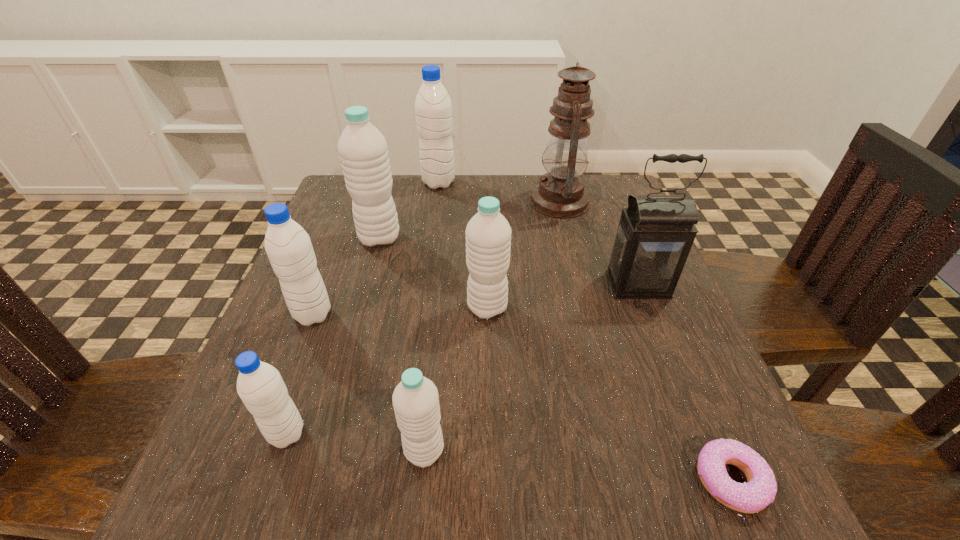
Find the location of a particular element. oil lamp is located at coordinates (560, 193).

Find the location of a particular element. The height and width of the screenshot is (540, 960). the farthest water bottle is located at coordinates (433, 107).

At what (x,y) coordinates should I click in order to perform the action: click on the rightmost gray water bottle. Please return your answer as a coordinate pair (x, y). The width and height of the screenshot is (960, 540). Looking at the image, I should click on (433, 107).

Where is `the leftmost white water bottle`? the leftmost white water bottle is located at coordinates (363, 150).

Where is `the biggest white water bottle`? the biggest white water bottle is located at coordinates (363, 150).

I want to click on lantern, so click(655, 234).

Where is `the second smallest white water bottle`? The height and width of the screenshot is (540, 960). the second smallest white water bottle is located at coordinates (488, 234).

Locate an element on the screen. The image size is (960, 540). the rightmost white water bottle is located at coordinates (488, 234).

Where is `the second farthest gray water bottle`? The image size is (960, 540). the second farthest gray water bottle is located at coordinates (288, 246).

Identify the location of the nearest gray water bottle. Image resolution: width=960 pixels, height=540 pixels. (260, 386).